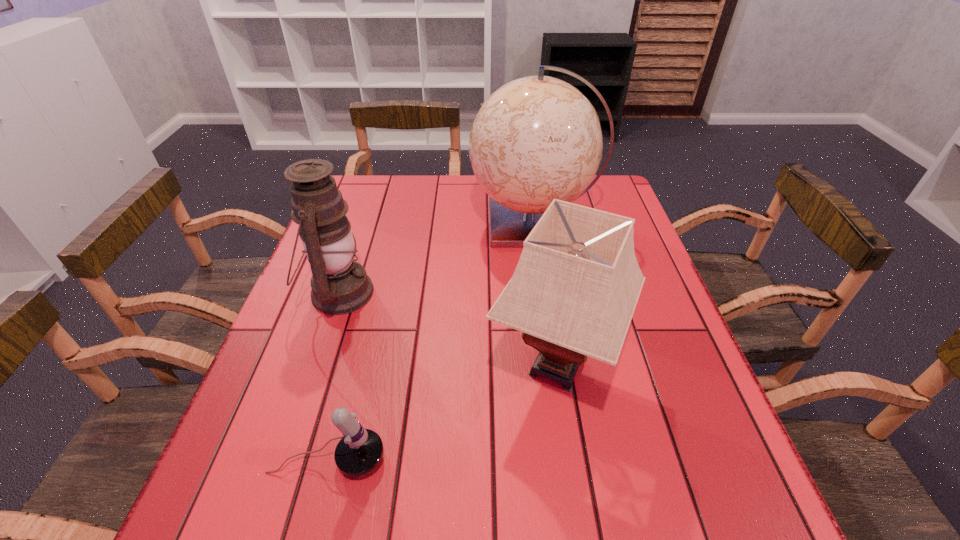
The height and width of the screenshot is (540, 960). Find the location of `vacant space at the far left corner of the desktop`. vacant space at the far left corner of the desktop is located at coordinates (375, 207).

The image size is (960, 540). I want to click on vacant space at the far right corner of the desktop, so click(x=599, y=191).

Where is `unoccupied area between the nearest object and the globe`? The image size is (960, 540). unoccupied area between the nearest object and the globe is located at coordinates (430, 341).

Identify the location of vacant point located between the lampshade and the shortest object. (443, 413).

Find the location of a particular element. This screenshot has width=960, height=540. vacant region between the shortest object and the lampshade is located at coordinates (443, 413).

This screenshot has height=540, width=960. In order to click on vacant area that lies between the oil lamp and the lampshade in this screenshot , I will do `click(447, 330)`.

Locate an element on the screen. vacant area that lies between the lampshade and the oil lamp is located at coordinates (447, 330).

Locate an element on the screen. unoccupied area between the globe and the microphone is located at coordinates (430, 341).

I want to click on free space between the microphone and the oil lamp, so [334, 376].

In order to click on free space between the farthest object and the microphone in this screenshot , I will do `click(430, 341)`.